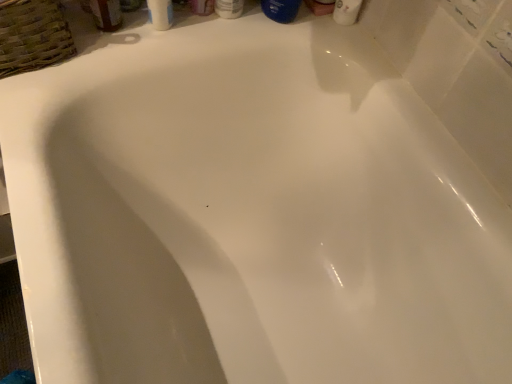
Where is `empty space that is to the right of matte plastic bottle at upper center, the second toiletry from the right`? empty space that is to the right of matte plastic bottle at upper center, the second toiletry from the right is located at coordinates (272, 23).